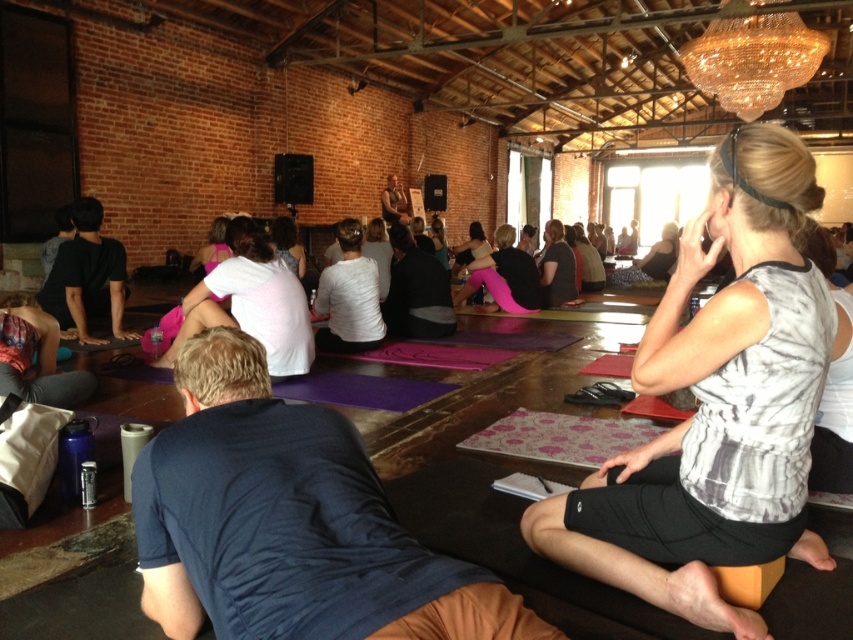
Is point (271, 280) farther from viewer compared to point (556, 266)?

No, (271, 280) is closer to viewer.

Does white cotton shirt at center appear over matte pink yoga mat at center?

Incorrect, white cotton shirt at center is not positioned above matte pink yoga mat at center.

The image size is (853, 640). What do you see at coordinates (251, 301) in the screenshot?
I see `white cotton shirt at center` at bounding box center [251, 301].

The image size is (853, 640). Identify the location of white cotton shirt at center. (251, 301).

Consider the image. Who is more forward, (766,426) or (274,323)?

Point (766,426)

Is point (700, 257) positioned after point (235, 298)?

No, it is not.

Between point (740, 147) and point (308, 316), which one is positioned in front?

Point (740, 147) is in front.

Identify the location of white printed tank top at center. This screenshot has height=640, width=853. (717, 404).

Is white matte shirt at center smaller than pink yoga pants at center?

Indeed, white matte shirt at center has a smaller size compared to pink yoga pants at center.

Is point (351, 298) positioned behind point (489, 276)?

No, (351, 298) is in front of (489, 276).

You are a GUI agent. You are given a task and a screenshot of the screen. Output one action in this format:
    pyautogui.click(x=<x>, y=<y>)
    Task: Click on the white matte shirt at center
    Image resolution: width=853 pixels, height=640 pixels.
    Given the screenshot: What is the action you would take?
    pyautogui.click(x=349, y=296)